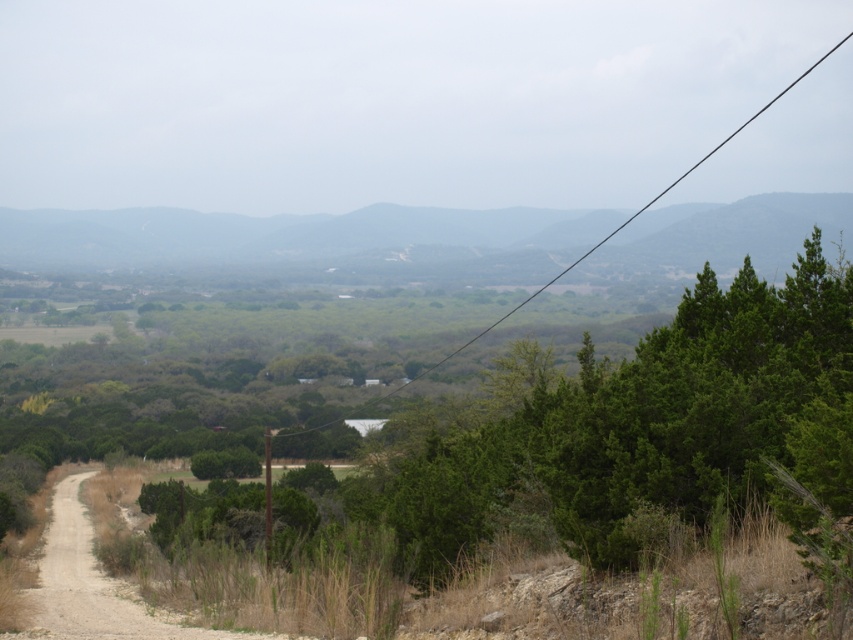
Consider the image. You are a hiker trying to determine the best spot to set up your tent. You notice a green leafy tree at center and a green grassy hill at center. Which location would provide more elevation for better visibility?

The green grassy hill at center is taller than the green leafy tree at center, so setting up the tent on the green grassy hill at center would provide more elevation for better visibility.

You are standing at the origin point in the image and want to reach the green leafy tree at center. According to the coordinates provided, in which direction should you move to reach it?

The green leafy tree at center is located at point 0.672 on the x axis and 0.751 on the y axis. Since you are at the origin, you should move to the right along the x axis and upwards along the y axis to reach it.

Consider the image. You are standing at the center of the dirt path in the rural landscape. You want to walk directly towards the green leafy tree at center. Which direction should you head?

The green leafy tree at center is located at point 0.672 on the x and 0.751 on the y axis. Since you are at the center of the dirt path, you should head northeast to reach it.